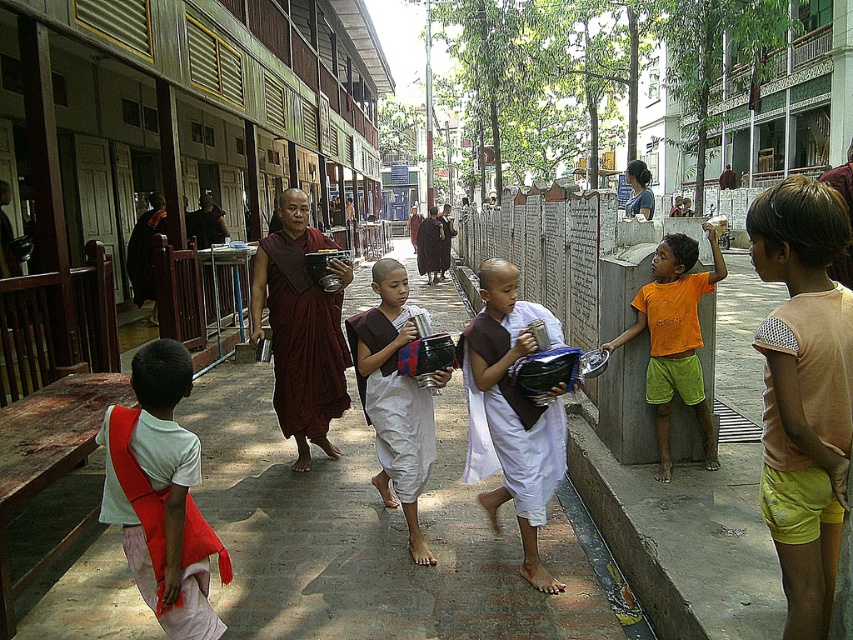
Does white cotton robe at center lie behind orange cotton shirt at right?

Yes, it is behind orange cotton shirt at right.

Is white cotton robe at center wider than orange cotton shirt at right?

No.

The image size is (853, 640). What do you see at coordinates (395, 396) in the screenshot?
I see `white cotton robe at center` at bounding box center [395, 396].

Identify the location of white cotton robe at center. Image resolution: width=853 pixels, height=640 pixels. (395, 396).

From the picture: Who is positioned more to the left, white cotton shirt at lower left or white cotton robe at center?

white cotton shirt at lower left is more to the left.

Does point (148, 397) lie in front of point (363, 371)?

Yes, point (148, 397) is in front of point (363, 371).

Is point (112, 497) farther from camera compared to point (408, 388)?

No, (112, 497) is in front of (408, 388).

The width and height of the screenshot is (853, 640). Identify the location of white cotton shirt at lower left. (161, 496).

Does white cotton shirt at lower left lie behind brown cotton shirt at center?

That is False.

Is white cotton shirt at lower left positioned before brown cotton shirt at center?

Yes, white cotton shirt at lower left is in front of brown cotton shirt at center.

Between point (199, 611) and point (473, 417), which one is positioned in front?

Point (199, 611) is more forward.

Locate an element on the screen. white cotton shirt at lower left is located at coordinates (161, 496).